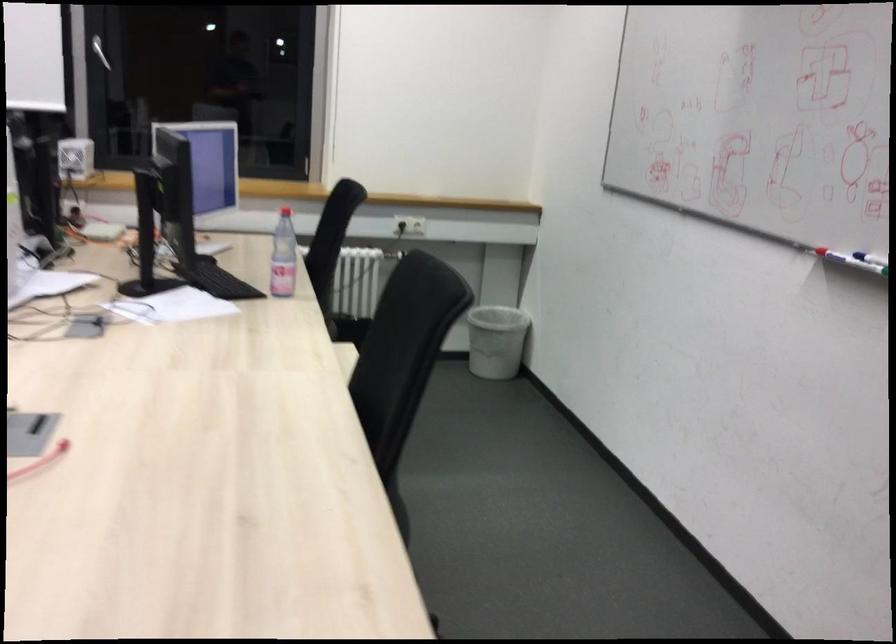
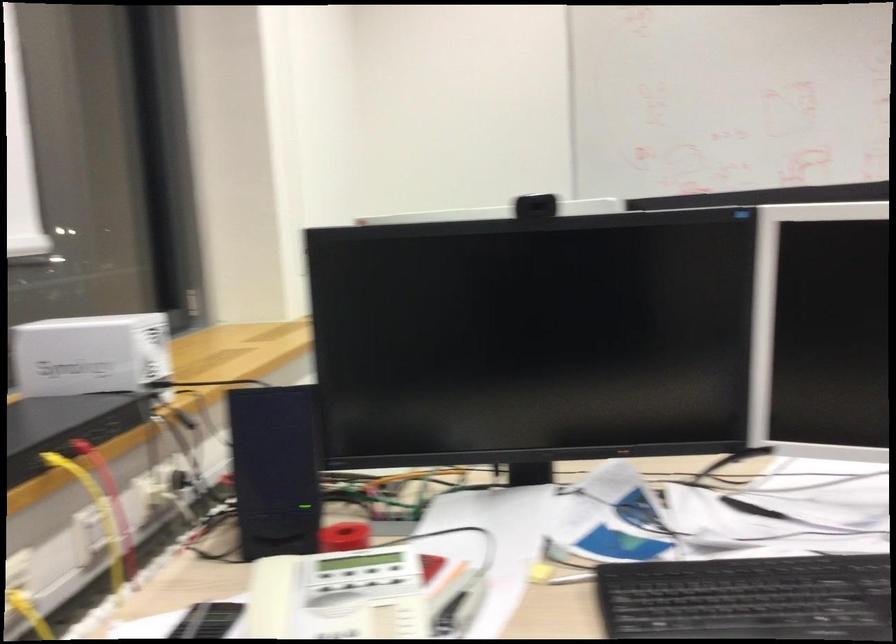
Locate, in the second image, the point that corresponds to pixel 74 149 in the first image.

(90, 354)